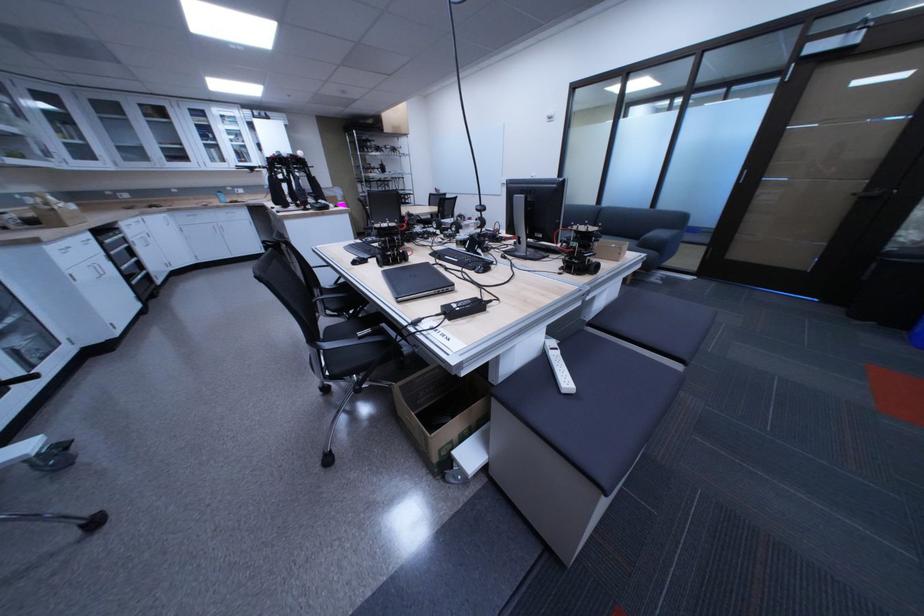
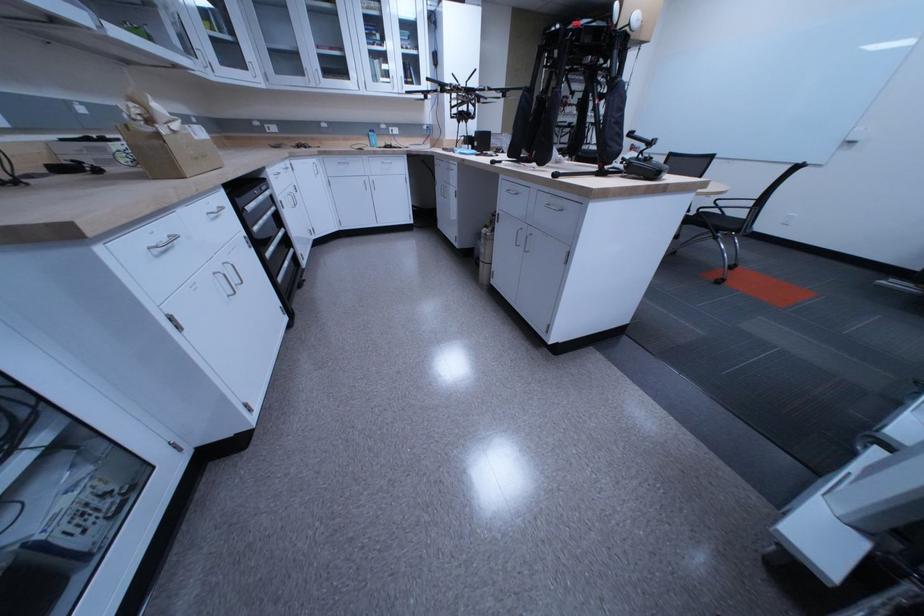
The point at (186,215) is marked in the first image. Where is the corresponding point in the second image?

(335, 159)